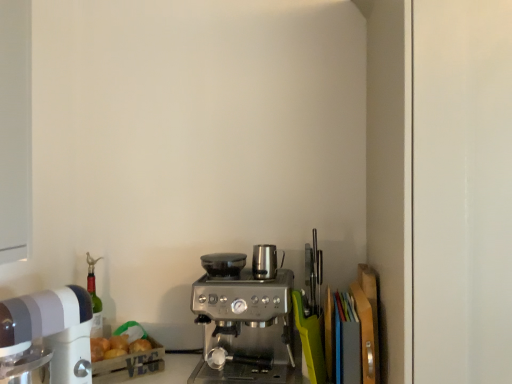
Question: Does white plastic mixer at left have a larger size compared to satin silver coffee maker at center?

Choices:
 (A) no
 (B) yes

Answer: (A)

Question: Does white plastic mixer at left appear on the left side of satin silver coffee maker at center?

Choices:
 (A) no
 (B) yes

Answer: (B)

Question: Can you see white plastic mixer at left touching satin silver coffee maker at center?

Choices:
 (A) no
 (B) yes

Answer: (A)

Question: From a real-world perspective, is white plastic mixer at left under satin silver coffee maker at center?

Choices:
 (A) no
 (B) yes

Answer: (A)

Question: Is white plastic mixer at left far away from satin silver coffee maker at center?

Choices:
 (A) no
 (B) yes

Answer: (A)

Question: From the image's perspective, does white plastic mixer at left appear lower than satin silver coffee maker at center?

Choices:
 (A) yes
 (B) no

Answer: (B)

Question: From a real-world perspective, does satin silver espresso machine at center, acting as the 1th appliance starting from the left, stand above white plastic mixer at left?

Choices:
 (A) no
 (B) yes

Answer: (B)

Question: Is satin silver espresso machine at center, acting as the 1th appliance starting from the left, with white plastic mixer at left?

Choices:
 (A) yes
 (B) no

Answer: (B)

Question: Is satin silver espresso machine at center, acting as the 1th appliance starting from the left, to the right of white plastic mixer at left from the viewer's perspective?

Choices:
 (A) yes
 (B) no

Answer: (A)

Question: From a real-world perspective, is satin silver espresso machine at center, acting as the 1th appliance starting from the left, located beneath white plastic mixer at left?

Choices:
 (A) no
 (B) yes

Answer: (A)

Question: Can you confirm if satin silver espresso machine at center, the 2th appliance positioned from the right, is taller than white plastic mixer at left?

Choices:
 (A) no
 (B) yes

Answer: (A)

Question: Is satin silver espresso machine at center, acting as the 1th appliance starting from the left, closer to camera compared to white plastic mixer at left?

Choices:
 (A) yes
 (B) no

Answer: (B)

Question: Can you confirm if satin silver espresso machine at center, the 2th appliance positioned from the right, is positioned to the left of satin silver kettle at center, arranged as the 2th appliance when viewed from the left?

Choices:
 (A) no
 (B) yes

Answer: (B)